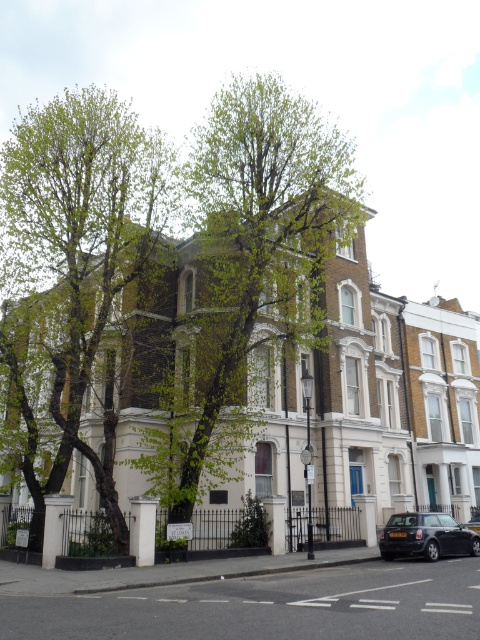
Question: Estimate the real-world distances between objects in this image. Which object is closer to the green leafy tree at left?

Choices:
 (A) black matte car at lower right
 (B) green leafy tree at center

Answer: (B)

Question: Estimate the real-world distances between objects in this image. Which object is farther from the green leafy tree at left?

Choices:
 (A) shiny black car at center
 (B) black matte car at lower right
 (C) green leafy tree at center

Answer: (A)

Question: Does green leafy tree at left have a greater width compared to black matte car at lower right?

Choices:
 (A) yes
 (B) no

Answer: (A)

Question: Can you confirm if green leafy tree at left is smaller than shiny black car at center?

Choices:
 (A) yes
 (B) no

Answer: (B)

Question: Can you confirm if green leafy tree at center is positioned above shiny black car at center?

Choices:
 (A) yes
 (B) no

Answer: (A)

Question: Which of the following is the closest to the observer?

Choices:
 (A) black matte car at lower right
 (B) green leafy tree at center
 (C) shiny black car at center

Answer: (A)